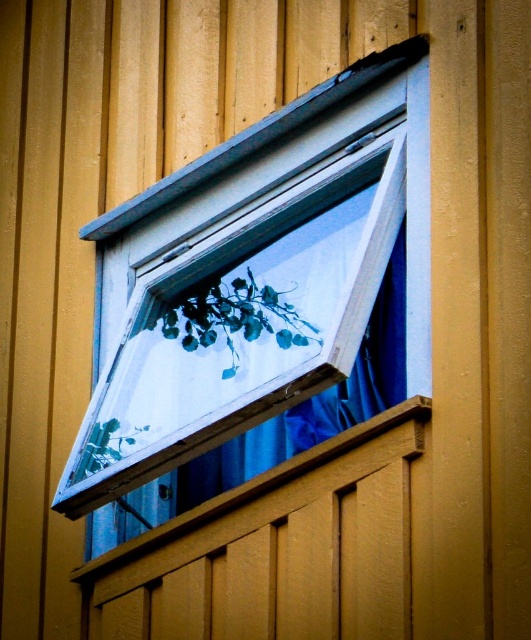
Is point (119, 317) positioned after point (422, 397)?

Yes, it is.

Is white plastic window frame at upper center wider than wooden at lower center?

In fact, white plastic window frame at upper center might be narrower than wooden at lower center.

What do you see at coordinates (261, 275) in the screenshot? This screenshot has width=531, height=640. I see `white plastic window frame at upper center` at bounding box center [261, 275].

Where is `white plastic window frame at upper center`? This screenshot has height=640, width=531. white plastic window frame at upper center is located at coordinates (261, 275).

Who is positioned more to the left, blue fabric curtain at upper center or green matte plant at center?

green matte plant at center

Can you confirm if blue fabric curtain at upper center is shorter than green matte plant at center?

No, blue fabric curtain at upper center is not shorter than green matte plant at center.

Is point (244, 481) in front of point (260, 289)?

No.

This screenshot has height=640, width=531. Find the location of `blue fabric curtain at upper center`. blue fabric curtain at upper center is located at coordinates (315, 401).

Which is behind, point (235, 305) or point (105, 467)?

Positioned behind is point (235, 305).

From the picture: Is green matte plant at center shorter than green leafy plant at lower left?

No.

Is point (293, 305) positioned before point (88, 460)?

Yes, point (293, 305) is closer to viewer.

The image size is (531, 640). What are the coordinates of `green matte plant at center` in the screenshot? It's located at (235, 317).